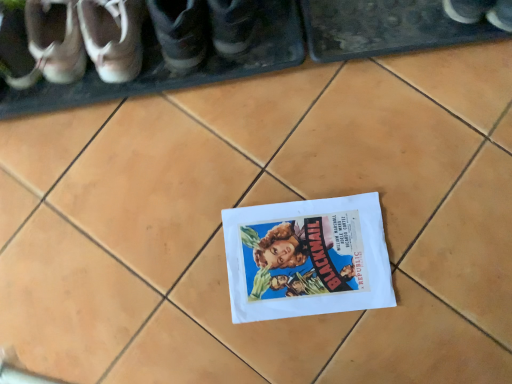
Question: From the image's perspective, would you say white leather shoe at left, marked as the sixth footwear in a right-to-left arrangement, is shown under matte black shoe at center, which is the sixth footwear in left-to-right order?

Choices:
 (A) yes
 (B) no

Answer: (A)

Question: Is white leather shoe at left, which ranks as the first footwear in left-to-right order, taller than matte black shoe at center, which is the sixth footwear in left-to-right order?

Choices:
 (A) no
 (B) yes

Answer: (A)

Question: From a real-world perspective, is white leather shoe at left, marked as the sixth footwear in a right-to-left arrangement, located beneath matte black shoe at center, which is the sixth footwear in left-to-right order?

Choices:
 (A) yes
 (B) no

Answer: (A)

Question: Could you tell me if white leather shoe at left, marked as the sixth footwear in a right-to-left arrangement, is facing matte black shoe at center, which is the sixth footwear in left-to-right order?

Choices:
 (A) no
 (B) yes

Answer: (A)

Question: Would you say matte black shoe at center, which is the sixth footwear in left-to-right order, is part of white leather shoe at left, which ranks as the first footwear in left-to-right order,'s contents?

Choices:
 (A) no
 (B) yes

Answer: (A)

Question: Based on their sizes in the image, would you say matte brown shoe at upper left, the fourth footwear from the right, is bigger or smaller than dark gray leather shoe at upper left, the 2th footwear from the right?

Choices:
 (A) small
 (B) big

Answer: (A)

Question: Is matte brown shoe at upper left, the fourth footwear from the right, situated inside dark gray leather shoe at upper left, the 2th footwear from the right, or outside?

Choices:
 (A) inside
 (B) outside

Answer: (B)

Question: In terms of width, does matte brown shoe at upper left, the fourth footwear from the right, look wider or thinner when compared to dark gray leather shoe at upper left, the 5th footwear from the left?

Choices:
 (A) wide
 (B) thin

Answer: (B)

Question: Is point (97, 34) closer or farther from the camera than point (197, 66)?

Choices:
 (A) farther
 (B) closer

Answer: (B)

Question: Is dark gray leather shoe at upper left, the 5th footwear from the left, inside or outside of matte black shoe at center, which is the sixth footwear in left-to-right order?

Choices:
 (A) inside
 (B) outside

Answer: (B)

Question: Relative to matte black shoe at center, the 1th footwear from the right, is dark gray leather shoe at upper left, the 5th footwear from the left, in front or behind?

Choices:
 (A) behind
 (B) front

Answer: (A)

Question: Looking at their shapes, would you say dark gray leather shoe at upper left, the 5th footwear from the left, is wider or thinner than matte black shoe at center, which is the sixth footwear in left-to-right order?

Choices:
 (A) thin
 (B) wide

Answer: (A)

Question: In terms of height, does dark gray leather shoe at upper left, the 5th footwear from the left, look taller or shorter compared to matte black shoe at center, the 1th footwear from the right?

Choices:
 (A) short
 (B) tall

Answer: (A)

Question: From their relative heights in the image, would you say matte leather shoes at upper left, which ranks as the 2th footwear in left-to-right order, is taller or shorter than matte brown shoe at upper left, the fourth footwear from the right?

Choices:
 (A) short
 (B) tall

Answer: (A)

Question: Considering their positions, is matte leather shoes at upper left, the fifth footwear positioned from the right, located in front of or behind matte brown shoe at upper left, marked as the third footwear in a left-to-right arrangement?

Choices:
 (A) behind
 (B) front

Answer: (A)